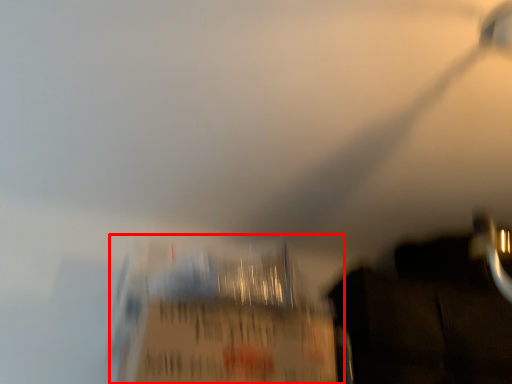
Question: From the image's perspective, where is cardboard box (annotated by the red box) located in relation to dark in the image?

Choices:
 (A) above
 (B) below

Answer: (A)